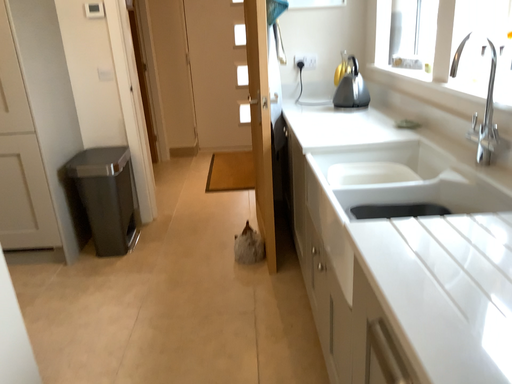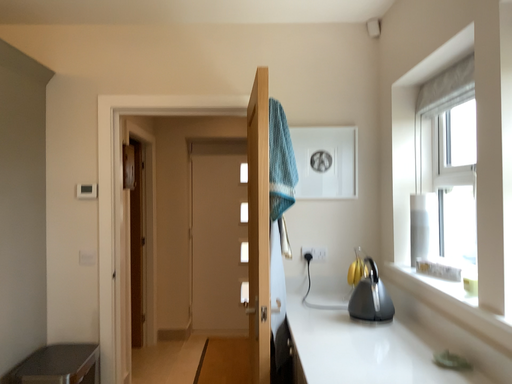
Question: Which way did the camera rotate in the video?

Choices:
 (A) rotated upward
 (B) rotated downward

Answer: (A)